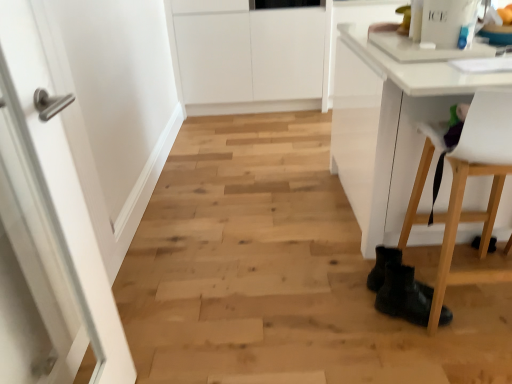
Question: Is white plastic chair at lower right wider than black leather boots at lower right?

Choices:
 (A) yes
 (B) no

Answer: (A)

Question: From the image's perspective, is white plastic chair at lower right above black leather boots at lower right?

Choices:
 (A) yes
 (B) no

Answer: (A)

Question: Could you tell me if white plastic chair at lower right is facing black leather boots at lower right?

Choices:
 (A) no
 (B) yes

Answer: (A)

Question: Is white plastic chair at lower right positioned behind black leather boots at lower right?

Choices:
 (A) no
 (B) yes

Answer: (A)

Question: Is white plastic chair at lower right at the right side of black leather boots at lower right?

Choices:
 (A) yes
 (B) no

Answer: (A)

Question: From a real-world perspective, is black leather boots at lower right above or below white plastic chair at lower right?

Choices:
 (A) above
 (B) below

Answer: (B)

Question: Is black leather boots at lower right wider or thinner than white plastic chair at lower right?

Choices:
 (A) wide
 (B) thin

Answer: (B)

Question: Is black leather boots at lower right taller or shorter than white plastic chair at lower right?

Choices:
 (A) short
 (B) tall

Answer: (A)

Question: From the image's perspective, is black leather boots at lower right located above or below white plastic chair at lower right?

Choices:
 (A) above
 (B) below

Answer: (B)

Question: Do you think white plastic chair at lower right is within white glossy door at left, or outside of it?

Choices:
 (A) outside
 (B) inside

Answer: (A)

Question: Is point (464, 142) positioned closer to the camera than point (27, 87)?

Choices:
 (A) farther
 (B) closer

Answer: (A)

Question: Considering the positions of white plastic chair at lower right and white glossy door at left in the image, is white plastic chair at lower right wider or thinner than white glossy door at left?

Choices:
 (A) thin
 (B) wide

Answer: (B)

Question: Is white plastic chair at lower right bigger or smaller than white glossy door at left?

Choices:
 (A) small
 (B) big

Answer: (B)

Question: From the image's perspective, is white glossy door at left located above or below black leather boots at lower right?

Choices:
 (A) below
 (B) above

Answer: (B)

Question: Would you say white glossy door at left is inside or outside black leather boots at lower right?

Choices:
 (A) inside
 (B) outside

Answer: (B)